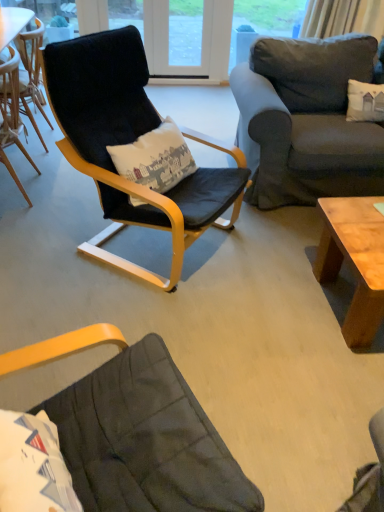
At what (x,y) coordinates should I click in order to perform the action: click on vacant space to the right of velvet black armchair at center, the second chair in the left-to-right sequence. Please return your answer as a coordinate pair (x, y). Looking at the image, I should click on (271, 265).